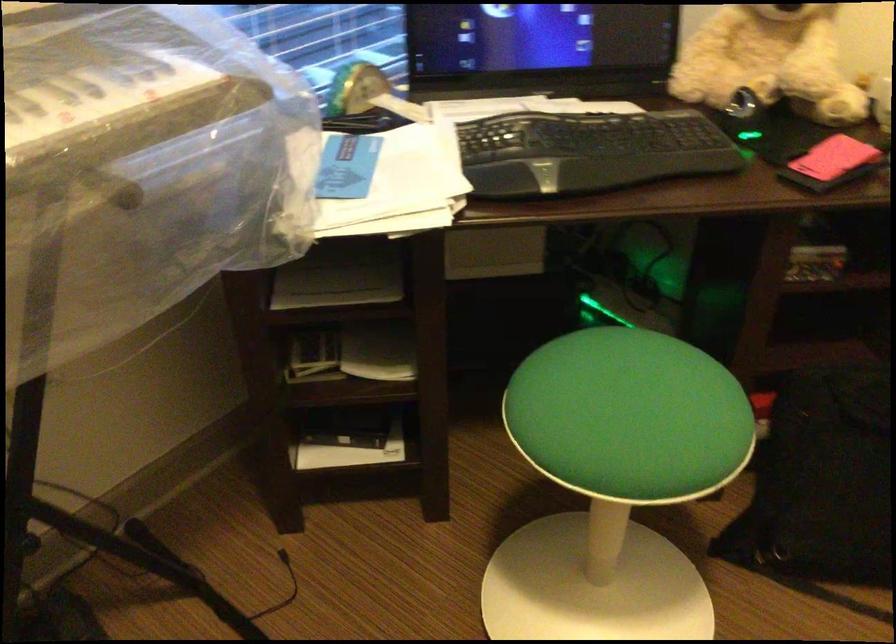
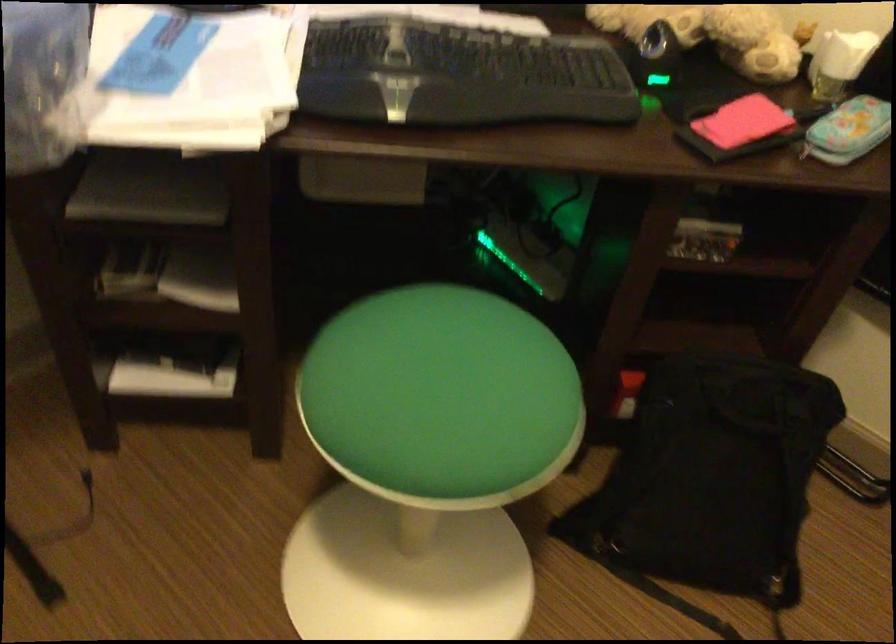
Find the pixel in the second image that matches (635,412) in the first image.

(441, 398)